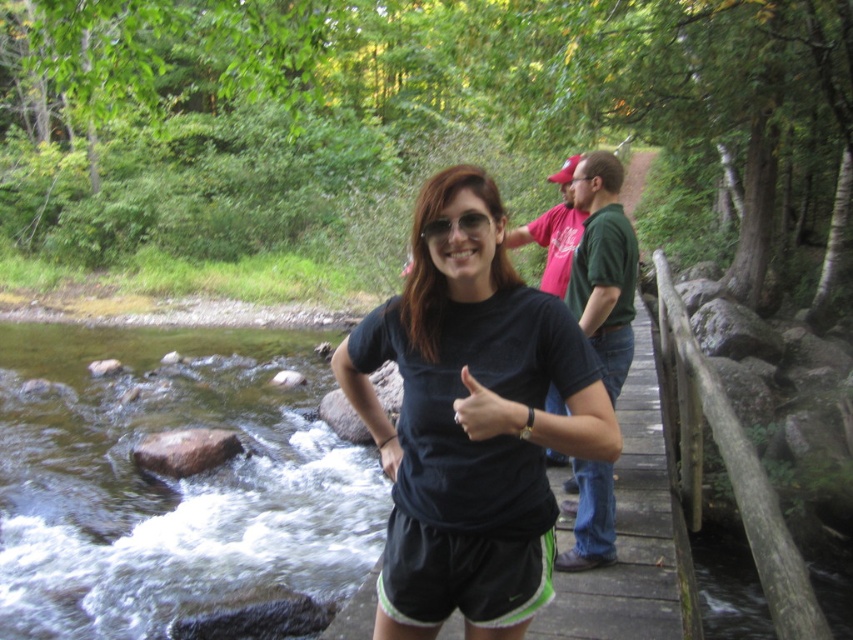
You are standing on the wooden bridge and want to throw a stone into the brown smooth water at lower left. If your throwing range is 4 meters, will you be able to reach it?

The distance between you and the brown smooth water at lower left is 4.17 meters, which exceeds your throwing range of 4 meters. Therefore, you won not be able to reach it.